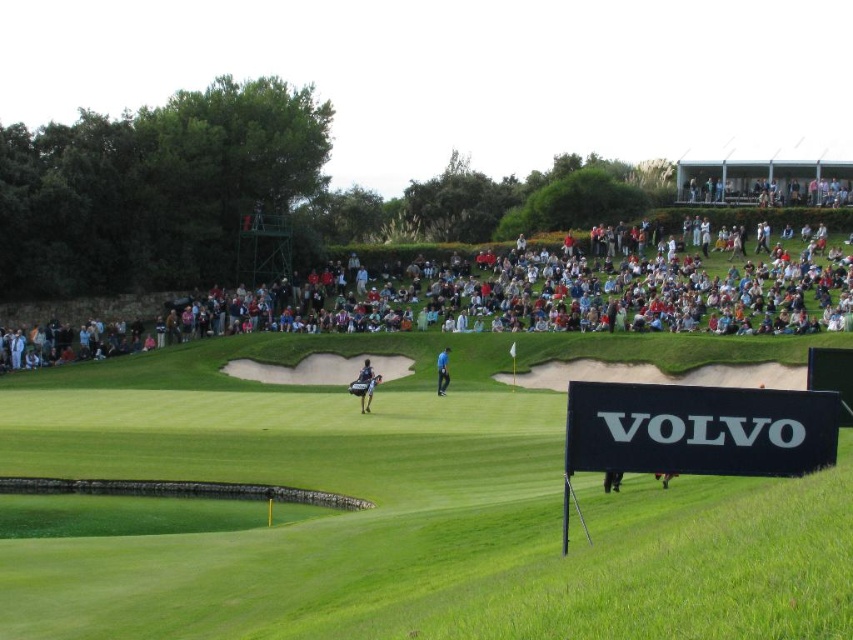
You are a golfer standing at the tee box preparing to hit your ball. You notice a point marked at coordinates (488, 304) on your map. What is located at that point?

The multicolored fabric crowd at upper center is located at point (488, 304).